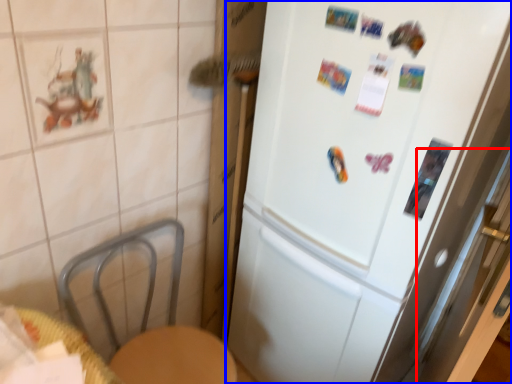
Question: Which of the following is the closest to the observer, screen door (highlighted by a red box) or refrigerator (highlighted by a blue box)?

Choices:
 (A) screen door
 (B) refrigerator

Answer: (A)